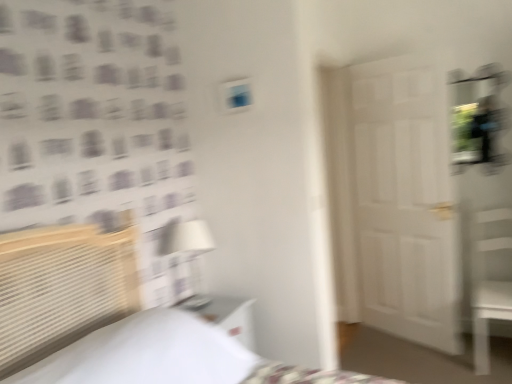
The height and width of the screenshot is (384, 512). Find the location of `free area below white fabric lampshade at center (from a real-world perspective)`. free area below white fabric lampshade at center (from a real-world perspective) is located at coordinates (199, 306).